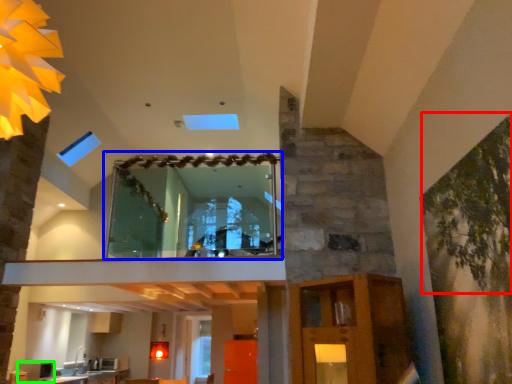
Question: Based on their relative distances, which object is nearer to plant (highlighted by a red box)? Choose from window (highlighted by a blue box) and appliance (highlighted by a green box).

Choices:
 (A) window
 (B) appliance

Answer: (A)